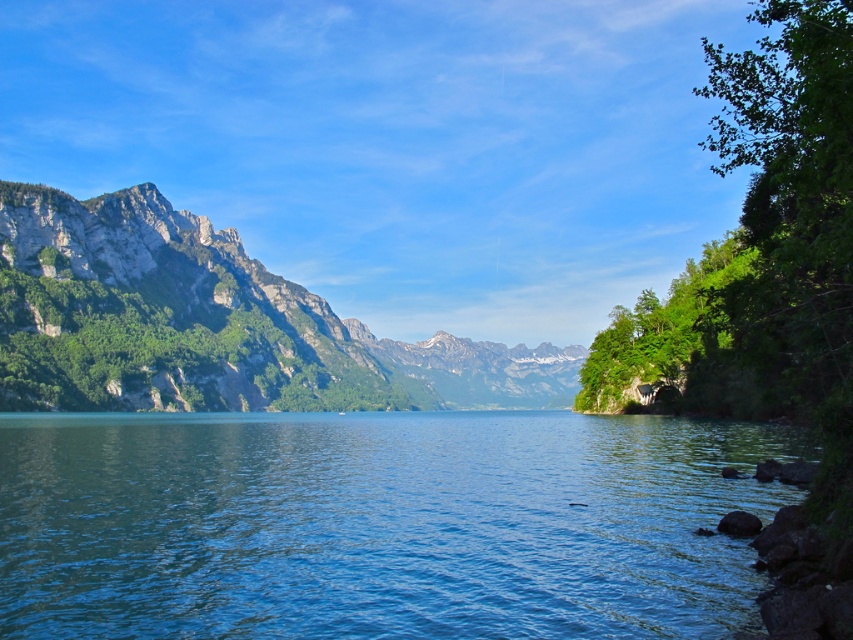
You are standing at the point with coordinates (379, 524) in the image. What is the color of the surface you are currently on?

The surface at point (379, 524) is green water at center.